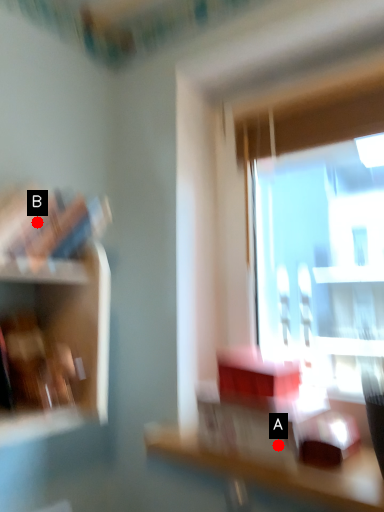
Question: Two points are circled on the image, labeled by A and B beside each circle. Among these points, which one is farthest from the camera?

Choices:
 (A) A is further
 (B) B is further

Answer: (B)